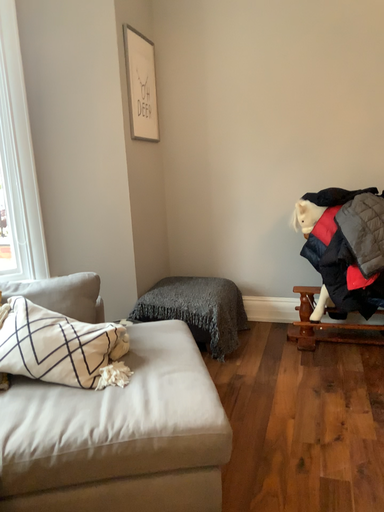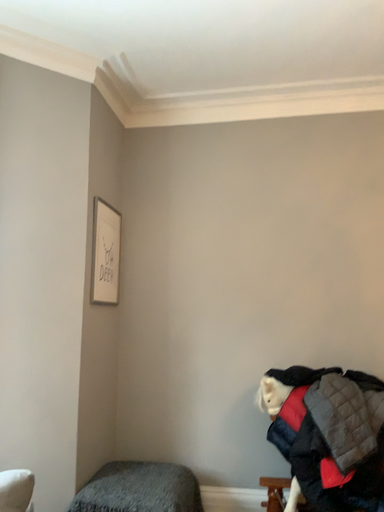
Question: Which way did the camera rotate in the video?

Choices:
 (A) rotated left
 (B) rotated right

Answer: (B)